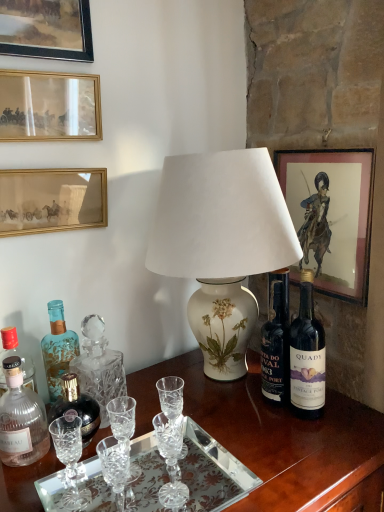
This screenshot has height=512, width=384. I want to click on vacant space to the right of matte glass bottle at center-left, arranged as the 2th bottle when viewed from the back, so click(151, 446).